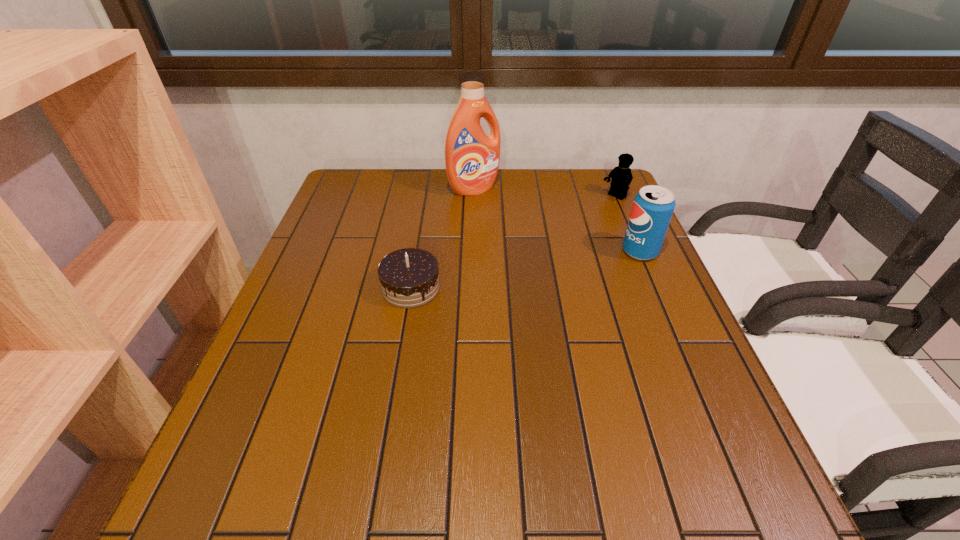
Image resolution: width=960 pixels, height=540 pixels. I want to click on free spot on the desktop that is between the nearest object and the soda can and is positioned on the front-facing side of the second shortest object, so click(503, 273).

Locate an element on the screen. vacant space on the desktop that is between the chocolate cake and the second tallest object and is positioned on the front-facing side of the tallest object is located at coordinates (552, 266).